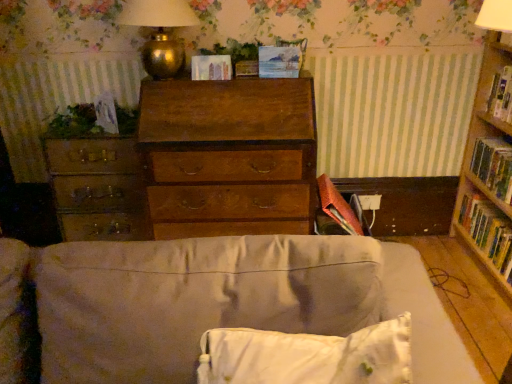
Locate an element on the screen. vacant region to the left of pastel blue paper at center, which ranks as the 3th paperback book in bottom-to-top order is located at coordinates (246, 77).